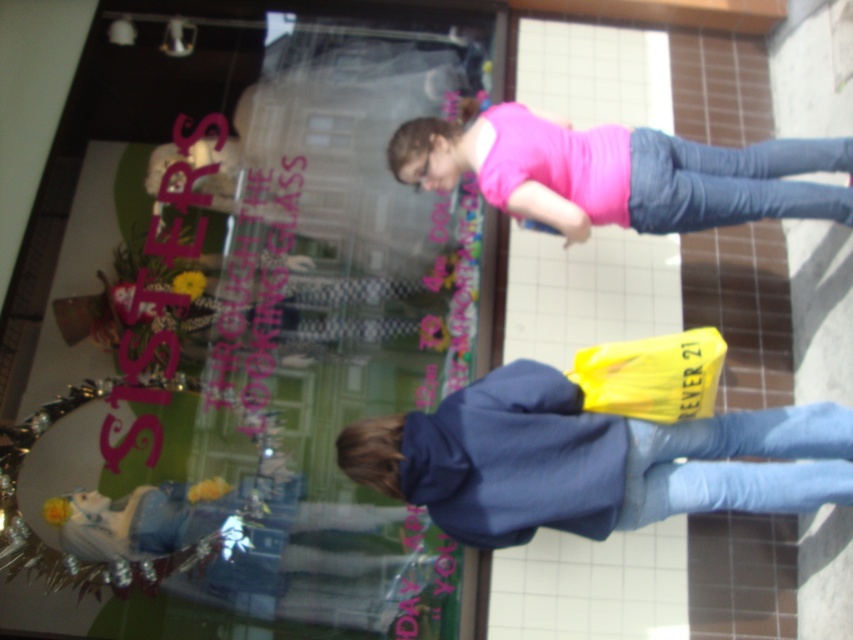
How distant is transparent glass at upper center from denim jeans at lower right?

transparent glass at upper center and denim jeans at lower right are 1.34 meters apart from each other.

Who is more distant from viewer, (347, 312) or (746, 438)?

Point (347, 312)

Who is more forward, [6,408] or [660,428]?

Point [660,428]

At what (x,y) coordinates should I click in order to perform the action: click on transparent glass at upper center. Please return your answer as a coordinate pair (x, y). Image resolution: width=853 pixels, height=640 pixels. Looking at the image, I should click on (236, 330).

Which is in front, point (196, 310) or point (660, 195)?

Point (660, 195) is more forward.

Does transparent glass at upper center have a lesser width compared to denim jeans at center?

Incorrect, transparent glass at upper center's width is not less than denim jeans at center's.

Which is behind, point (32, 588) or point (694, 177)?

Point (32, 588)

You are a GUI agent. You are given a task and a screenshot of the screen. Output one action in this format:
    pyautogui.click(x=<x>, y=<y>)
    Task: Click on the transparent glass at upper center
    
    Given the screenshot: What is the action you would take?
    pyautogui.click(x=236, y=330)

Looking at this image, can you confirm if blue denim jacket at lower right is positioned above denim jeans at center?

No.

How much distance is there between blue denim jacket at lower right and denim jeans at center?

They are 70.70 centimeters apart.

Is point (605, 516) farther from viewer compared to point (635, 221)?

No, (605, 516) is in front of (635, 221).

This screenshot has height=640, width=853. I want to click on blue denim jacket at lower right, so click(x=589, y=460).